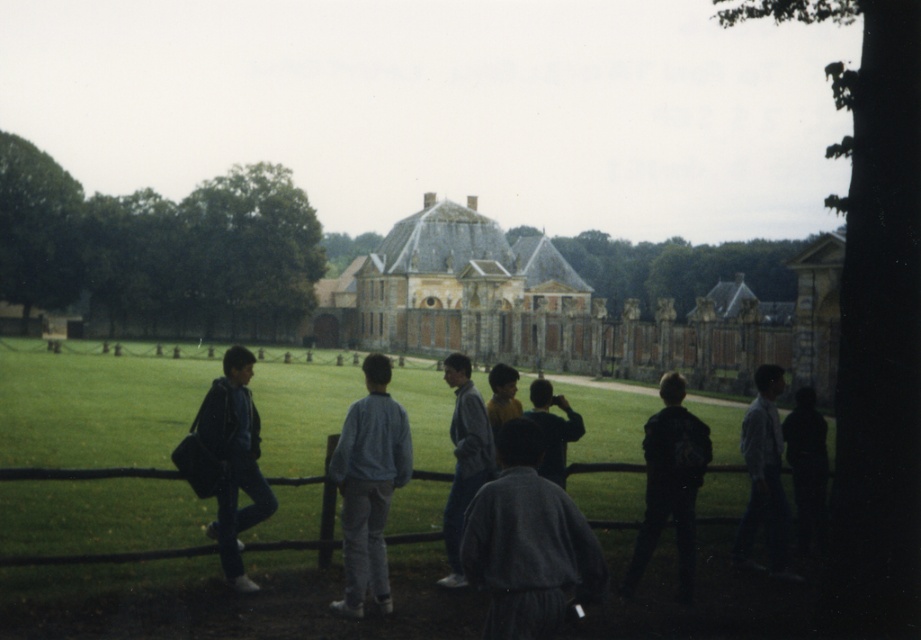
Does gray wool sweater at center have a lesser height compared to light blue shirt at center?

Indeed, gray wool sweater at center has a lesser height compared to light blue shirt at center.

Can you confirm if gray wool sweater at center is positioned below light blue shirt at center?

Actually, gray wool sweater at center is above light blue shirt at center.

Where is `gray wool sweater at center`? The height and width of the screenshot is (640, 921). gray wool sweater at center is located at coordinates (528, 544).

Between yellow stone palace at center and yellow matte shirt at center, which one has more height?

yellow stone palace at center

Is point (539, 262) in front of point (507, 410)?

No, (539, 262) is behind (507, 410).

Where is `yellow stone palace at center`? The image size is (921, 640). yellow stone palace at center is located at coordinates (569, 308).

Who is positioned more to the left, brown wooden fence at lower center or dark gray sweatshirt at center?

Positioned to the left is brown wooden fence at lower center.

Find the location of a particular element. Image resolution: width=921 pixels, height=640 pixels. brown wooden fence at lower center is located at coordinates (106, 556).